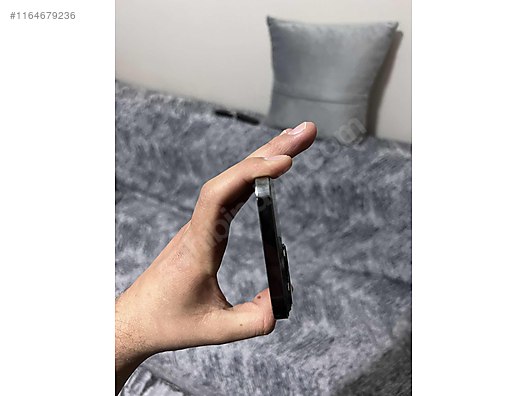
The width and height of the screenshot is (528, 396). Identify the location of grey couch. (337, 303).